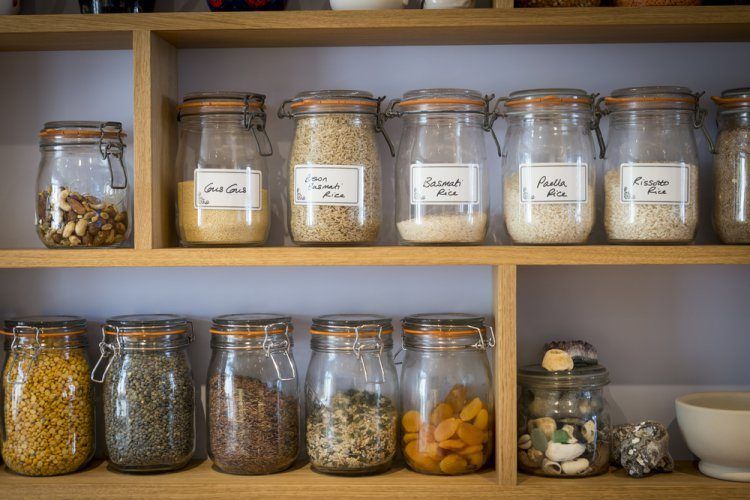
Find the location of a particular element. This screenshot has height=500, width=750. paper labels on the jars is located at coordinates (235, 181), (336, 181), (427, 181), (554, 182), (639, 177).